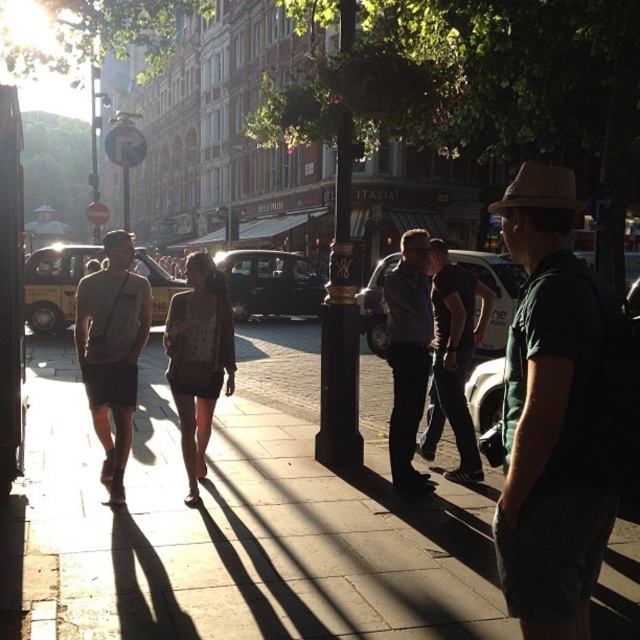
You are a street photographer wanting to capture a candid shot of the green cotton shirt at right and the dark gray shirt at center. Since you want to ensure both subjects are in focus, you need to know which one is closer to the camera. Can you determine which shirt is closer based on their sizes?

The green cotton shirt at right is thinner than dark gray shirt at center, so the green cotton shirt at right is farther away from the camera compared to the dark gray shirt at center.

You are a photographer standing at the camera position. You want to take a photo of both point (205, 586) and point (108, 360). Which point will appear larger in your photo?

Point (205, 586) is closer to the camera than point (108, 360). Since objects closer to the camera appear larger in a photo, point (205, 586) will appear larger in the photo.